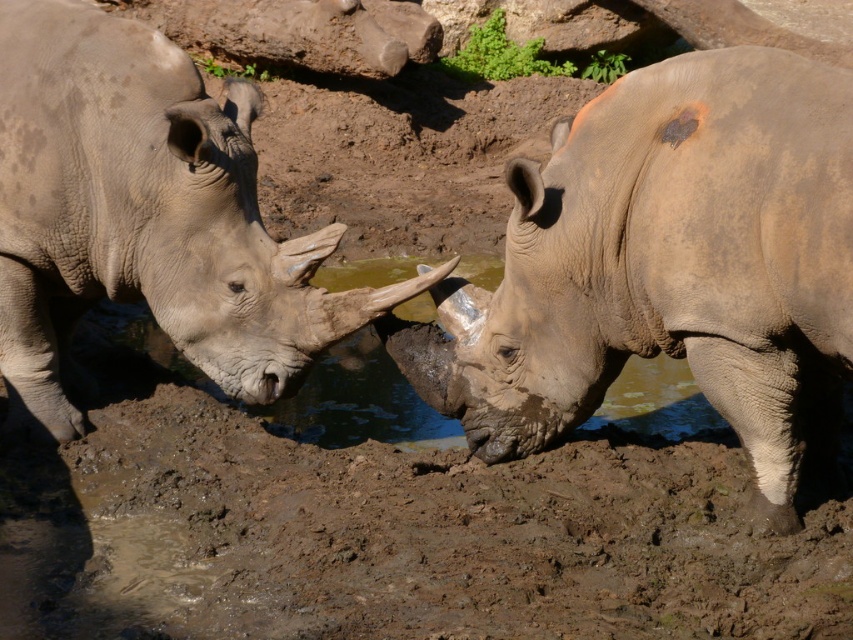
Can you confirm if gray textured rhino at center is positioned to the right of gray matte rhinoceros at left?

Indeed, gray textured rhino at center is positioned on the right side of gray matte rhinoceros at left.

Can you confirm if gray textured rhino at center is wider than gray matte rhinoceros at left?

Incorrect, gray textured rhino at center's width does not surpass gray matte rhinoceros at left's.

Is point (689, 125) farther from viewer compared to point (242, 387)?

No, it is not.

This screenshot has height=640, width=853. I want to click on gray textured rhino at center, so click(x=666, y=266).